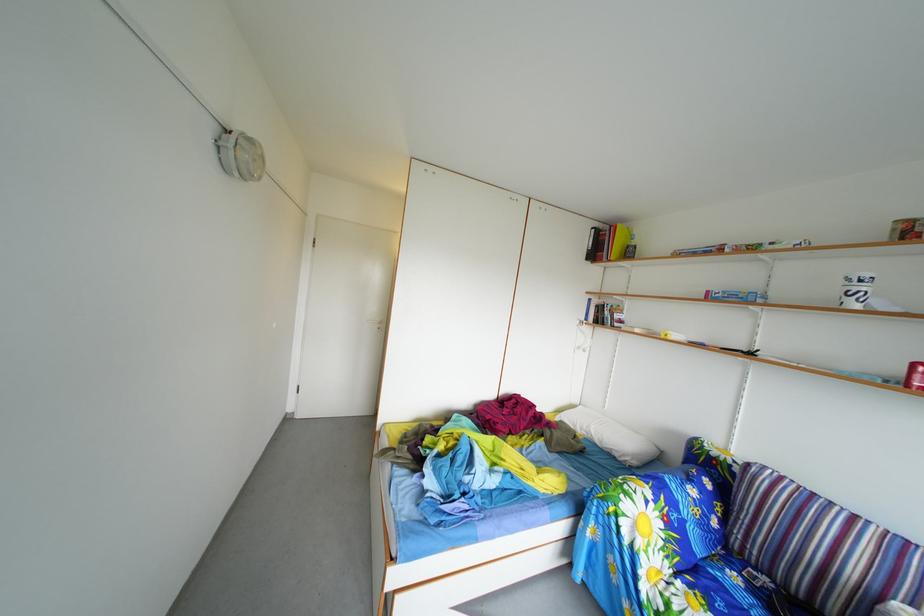
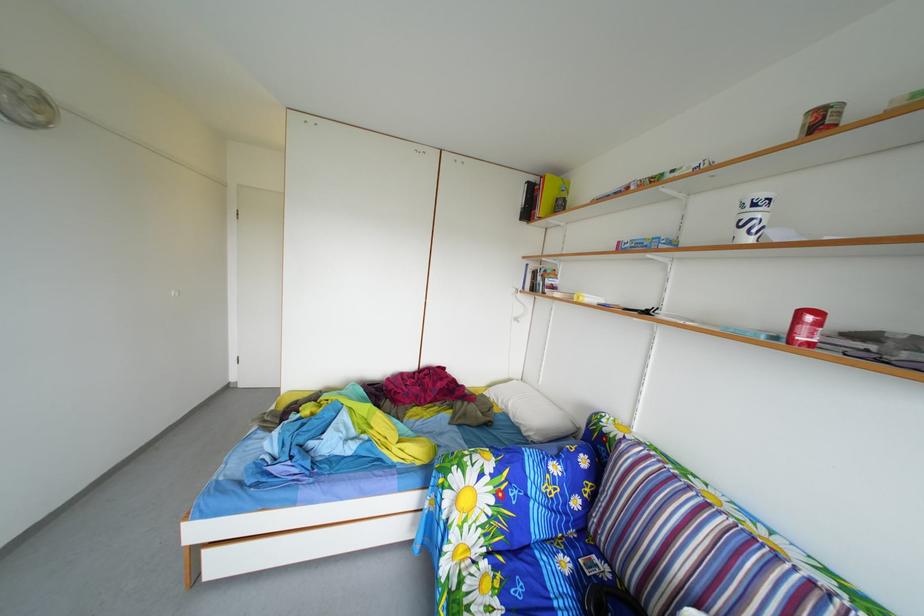
Find the pixel in the second image that matches (x=872, y=290) in the first image.

(766, 214)